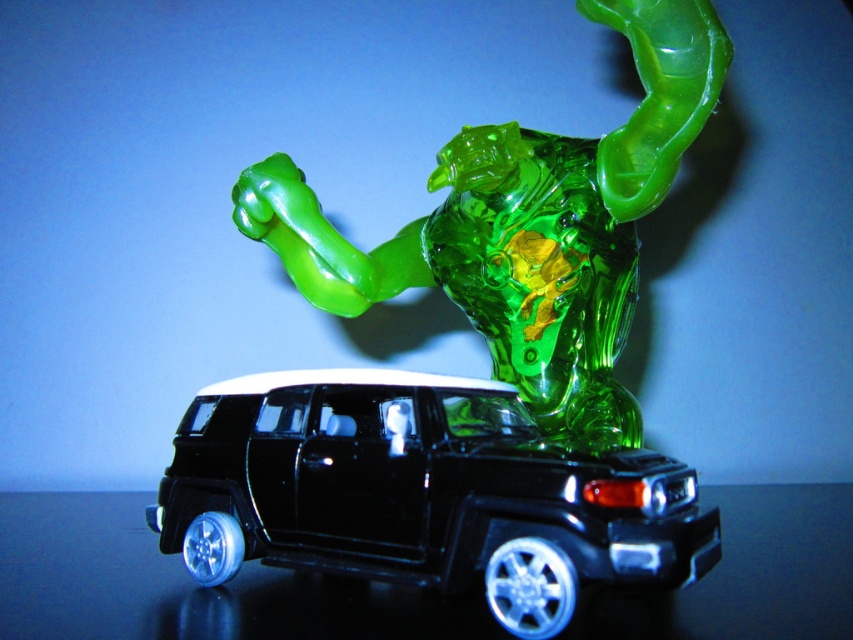
Is point (434, 476) more distant than point (660, 19)?

No, (434, 476) is closer to viewer.

Who is more forward, [299,508] or [648,115]?

Point [299,508] is more forward.

Locate an element on the screen. The height and width of the screenshot is (640, 853). black plastic toy car at center is located at coordinates (421, 492).